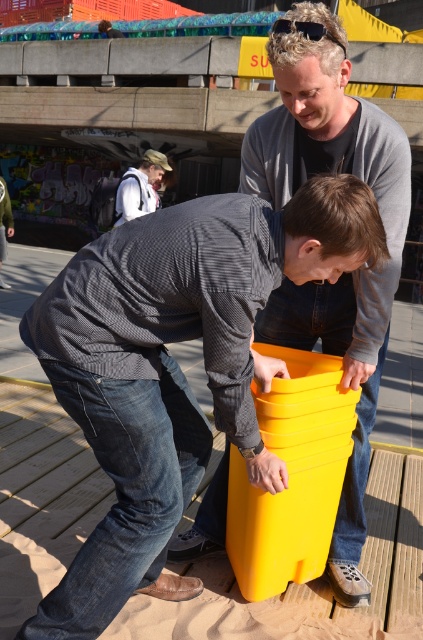
You are a painter who needs to set up your supplies. You have a matte yellow bucket at center and a matte yellow plastic bucket at center. Which bucket should you place higher to avoid water spilling from the upper bucket onto the lower one?

The matte yellow plastic bucket at center should be placed higher than the matte yellow bucket at center to prevent water from spilling from the upper bucket onto the lower one, as the matte yellow bucket at center is positioned under the matte yellow plastic bucket at center.

You are standing at the center of the wooden deck. There is a matte yellow bucket at center represented by point (175, 365). If you walk straight ahead, will you reach the matte yellow bucket at center before the concrete structure with graffiti on its underside?

The matte yellow bucket at center is located at point (175, 365), which is the center of the wooden deck. Since you are already at the center, you are already at the matte yellow bucket at center and do not need to walk forward to reach it.

You are a photographer trying to capture both the matte yellow bucket at center and the white cotton shirt at upper left in the same frame. Based on their positions, which object should you focus on first to ensure both are in focus?

The matte yellow bucket at center is located below the white cotton shirt at upper left, so you should focus on the white cotton shirt at upper left first to ensure both are in focus since it is higher up and the bucket is lower, allowing for a depth of field that includes both.